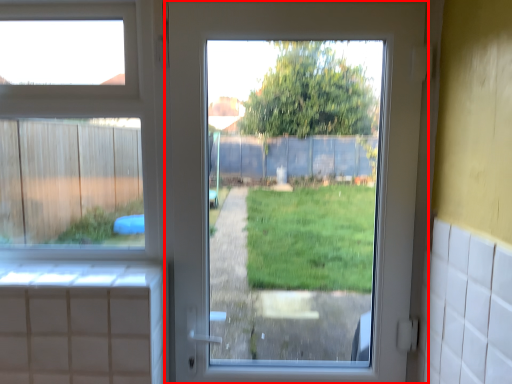
Question: From the image's perspective, considering the relative positions of door (annotated by the red box) and window in the image provided, where is door (annotated by the red box) located with respect to the staircase?

Choices:
 (A) above
 (B) below

Answer: (B)